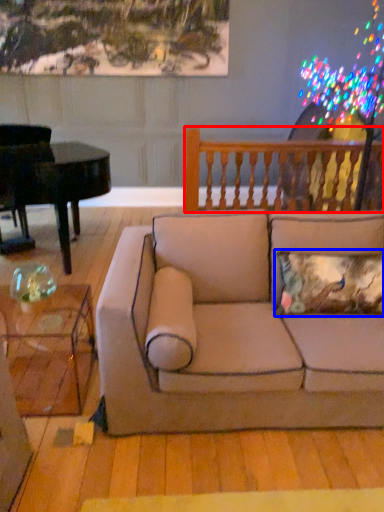
Question: Which of the following is the closest to the observer, rail (highlighted by a red box) or pillow (highlighted by a blue box)?

Choices:
 (A) rail
 (B) pillow

Answer: (B)